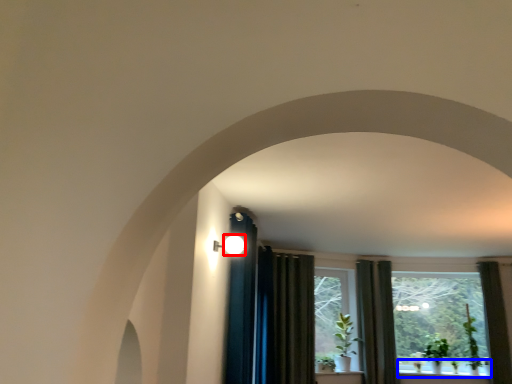
Question: Which point is further to the camera, light (highlighted by a red box) or window sill (highlighted by a blue box)?

Choices:
 (A) light
 (B) window sill

Answer: (B)